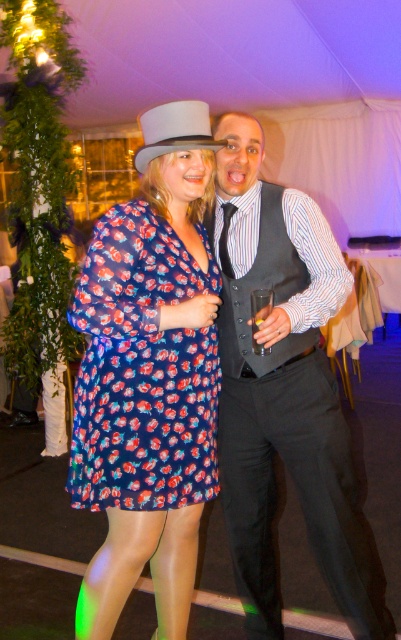
You are a photographer at this event and need to adjust the lighting for a closeup shot of both the matte black vest at center and the floral print fabric dress at center. Since the vest is larger, which object should you focus on first to ensure proper exposure?

The matte black vest at center is bigger than the floral print fabric dress at center, so you should focus on the matte black vest at center first to ensure proper exposure.

You are a photographer at a wedding reception. You need to adjust the lighting to highlight both the matte black vest at center and the black satin tie at center. Since both are black, how can you use the spatial relationship between them to ensure both are visible in the photo?

The matte black vest at center is below the black satin tie at center. By angling the light source above the black satin tie at center, you can create a shadow from the tie onto the vest, making both distinguishable through their positional relationship.

You are standing at the entrance of the event venue and want to locate the floral print fabric dress at center. According to the coordinates provided, in which direction should you look relative to the center of the image?

The floral print fabric dress at center is located at point 0.580 on the x axis and 0.357 on the y axis. Since the coordinates are relative to the image center, you should look slightly to the right and slightly downward to find it.